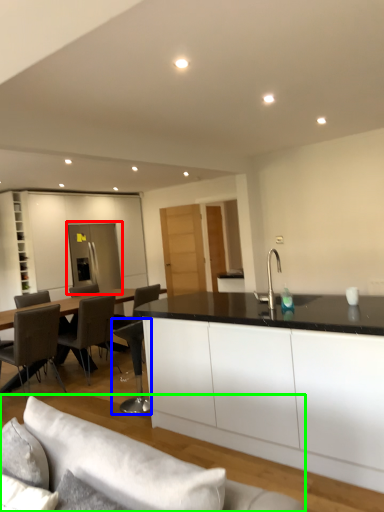
Question: Which is farther away from glass door (highlighted by a red box)? chair (highlighted by a blue box) or studio couch (highlighted by a green box)?

Choices:
 (A) chair
 (B) studio couch

Answer: (B)